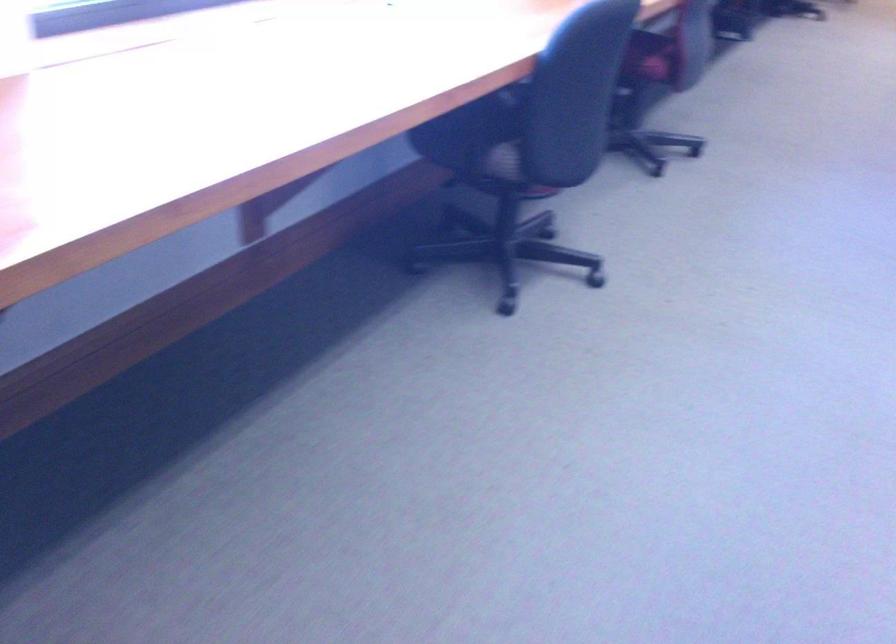
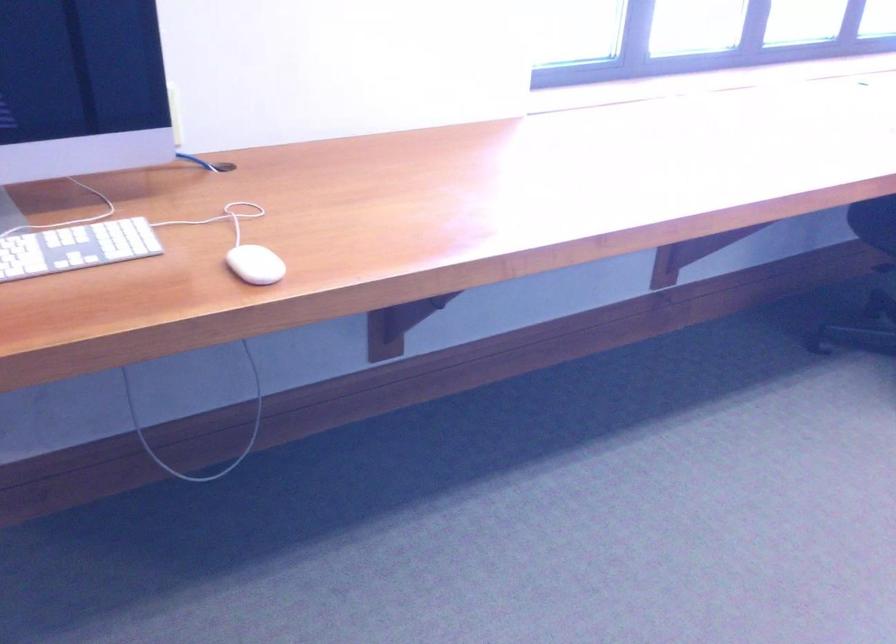
Question: Based on the continuous images, in which direction is the camera rotating? Reply with the corresponding letter.

Choices:
 (A) Left
 (B) Right
 (C) Up
 (D) Down

Answer: (A)